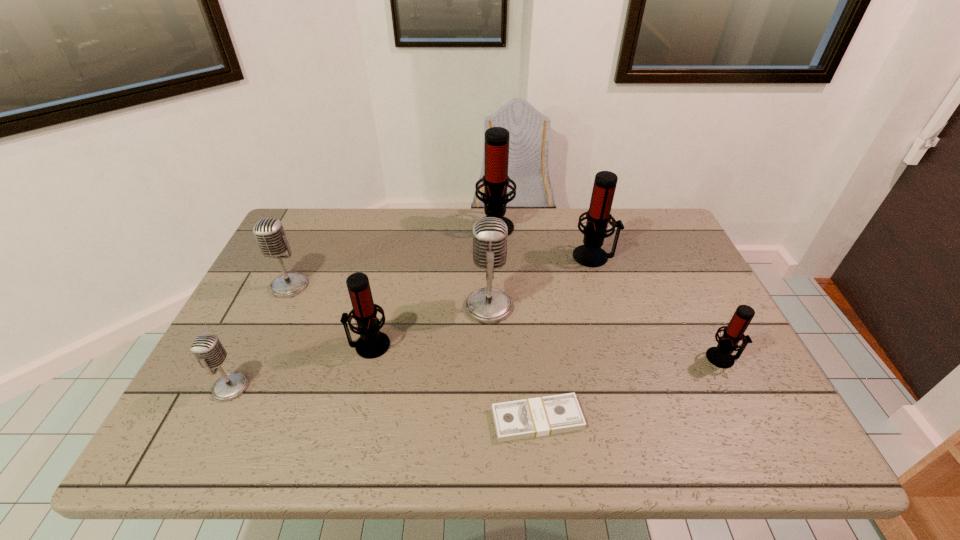
You are a GUI agent. You are given a task and a screenshot of the screen. Output one action in this format:
    pyautogui.click(x=<x>, y=<y>)
    Task: Click on the free space between the second biggest gray microphone and the rightmost microphone
    The height and width of the screenshot is (540, 960).
    Given the screenshot: What is the action you would take?
    pyautogui.click(x=506, y=322)

At what (x,y) coordinates should I click in order to perform the action: click on empty space that is in between the dollar and the third red microphone from left to right. Please return your answer as a coordinate pair (x, y). This screenshot has width=960, height=540. Looking at the image, I should click on (565, 338).

At what (x,y) coordinates should I click in order to perform the action: click on free space between the rightmost gray microphone and the second smallest gray microphone. Please return your answer as a coordinate pair (x, y). Looking at the image, I should click on coord(390,296).

Identify the location of free space between the shortest object and the nearest gray microphone. Image resolution: width=960 pixels, height=540 pixels. (384, 403).

Locate an element on the screen. vacant region between the tallest object and the sixth object from right to left is located at coordinates (432, 285).

Where is `empty space that is in between the rightmost object and the third red microphone from left to right`? empty space that is in between the rightmost object and the third red microphone from left to right is located at coordinates (659, 307).

In order to click on vacant space that's between the third biggest red microphone and the third red microphone from right to left in this screenshot , I will do `click(432, 285)`.

Locate an element on the screen. This screenshot has height=540, width=960. object that can be found as the third closest to the second red microphone from right to left is located at coordinates (721, 356).

Choose which object is the fifth nearest neighbor to the biggest gray microphone. Please provide its 2D coordinates. Your answer should be formatted as a tuple, i.e. [(x, y)], where the tuple contains the x and y coordinates of a point satisfying the conditions above.

[(269, 232)]

Where is `microphone that stands as the sixth closest to the fifth microphone from right to left`? This screenshot has height=540, width=960. microphone that stands as the sixth closest to the fifth microphone from right to left is located at coordinates (721, 356).